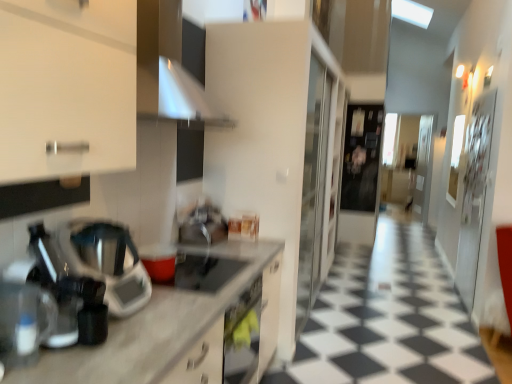
Question: From the image's perspective, is sleek metallic coffee machine at left, which ranks as the first coffee machine in back-to-front order, on top of matte black gas stove at center?

Choices:
 (A) no
 (B) yes

Answer: (B)

Question: Are sleek metallic coffee machine at left, arranged as the second coffee machine when viewed from the front, and matte black gas stove at center far apart?

Choices:
 (A) yes
 (B) no

Answer: (B)

Question: Does sleek metallic coffee machine at left, arranged as the second coffee machine when viewed from the front, have a greater height compared to matte black gas stove at center?

Choices:
 (A) no
 (B) yes

Answer: (B)

Question: Is sleek metallic coffee machine at left, arranged as the second coffee machine when viewed from the front, in front of matte black gas stove at center?

Choices:
 (A) no
 (B) yes

Answer: (B)

Question: Is matte black gas stove at center at the back of sleek metallic coffee machine at left, which ranks as the first coffee machine in back-to-front order?

Choices:
 (A) yes
 (B) no

Answer: (B)

Question: Does point (156, 117) appear closer or farther from the camera than point (90, 236)?

Choices:
 (A) closer
 (B) farther

Answer: (B)

Question: Considering the relative positions of satin silver exhaust hood at upper center and metallic silver blender at left in the image provided, is satin silver exhaust hood at upper center to the left or to the right of metallic silver blender at left?

Choices:
 (A) right
 (B) left

Answer: (A)

Question: Considering the positions of satin silver exhaust hood at upper center and metallic silver blender at left in the image, is satin silver exhaust hood at upper center wider or thinner than metallic silver blender at left?

Choices:
 (A) thin
 (B) wide

Answer: (B)

Question: Is satin silver exhaust hood at upper center in front of or behind metallic silver blender at left in the image?

Choices:
 (A) front
 (B) behind

Answer: (B)

Question: Looking at the image, does satin silver sink at center seem bigger or smaller compared to matte black gas stove at center?

Choices:
 (A) big
 (B) small

Answer: (A)

Question: Is satin silver sink at center inside or outside of matte black gas stove at center?

Choices:
 (A) inside
 (B) outside

Answer: (B)

Question: Is satin silver sink at center to the left or to the right of matte black gas stove at center in the image?

Choices:
 (A) right
 (B) left

Answer: (B)

Question: From the image's perspective, is satin silver sink at center above or below matte black gas stove at center?

Choices:
 (A) above
 (B) below

Answer: (A)

Question: From their relative heights in the image, would you say matte black gas stove at center is taller or shorter than white marble countertop at left?

Choices:
 (A) short
 (B) tall

Answer: (A)

Question: In the image, is matte black gas stove at center on the left side or the right side of white marble countertop at left?

Choices:
 (A) left
 (B) right

Answer: (B)